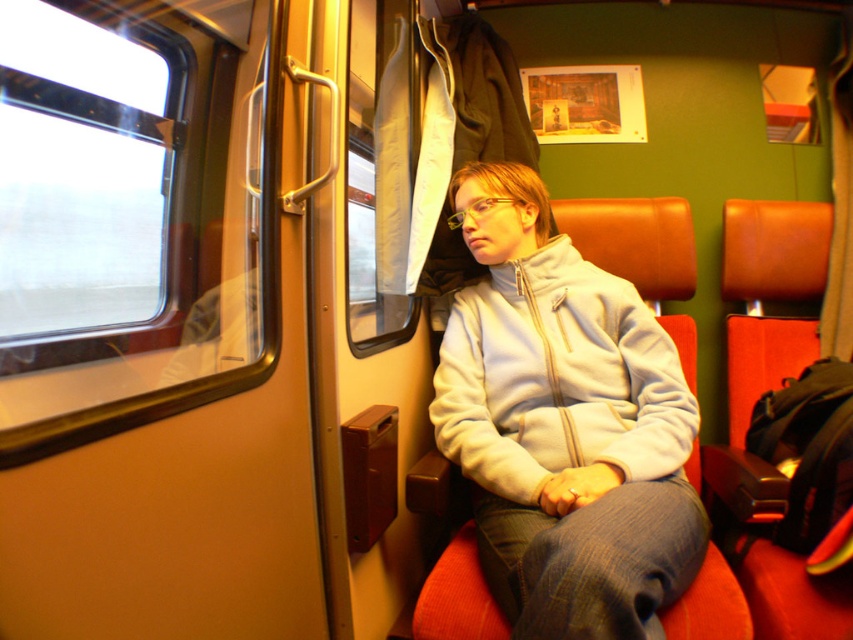
Is transparent glass window at left positioned in front of white fleece sweatshirt at center?

Yes, transparent glass window at left is closer to the viewer.

At what (x,y) coordinates should I click in order to perform the action: click on transparent glass window at left. Please return your answer as a coordinate pair (x, y). The image size is (853, 640). Looking at the image, I should click on (137, 241).

The image size is (853, 640). Find the location of `transparent glass window at left`. transparent glass window at left is located at coordinates (137, 241).

Locate an element on the screen. The width and height of the screenshot is (853, 640). transparent glass window at left is located at coordinates (137, 241).

Can you confirm if white fleece sweatshirt at center is positioned above transparent plastic window at upper center?

No, white fleece sweatshirt at center is not above transparent plastic window at upper center.

Who is lower down, white fleece sweatshirt at center or transparent plastic window at upper center?

white fleece sweatshirt at center is lower down.

Does point (508, 436) lie behind point (351, 186)?

No, (508, 436) is in front of (351, 186).

Find the location of a particular element. Image resolution: width=853 pixels, height=640 pixels. white fleece sweatshirt at center is located at coordinates (556, 378).

Is point (202, 67) more distant than point (393, 28)?

That is False.

Between point (103, 134) and point (372, 164), which one is positioned behind?

The point (372, 164) is behind.

The width and height of the screenshot is (853, 640). Identify the location of transparent glass window at left. (137, 241).